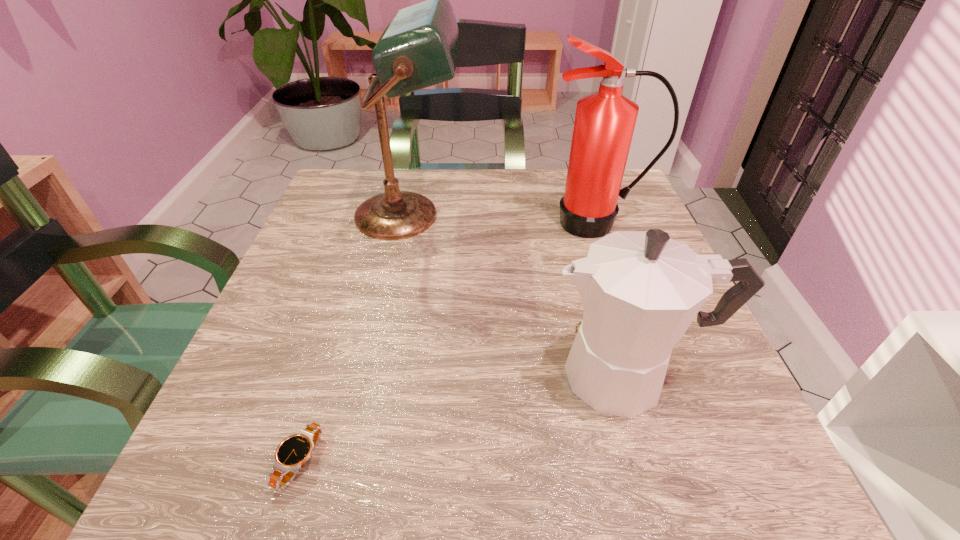
Locate an element on the screen. This screenshot has width=960, height=540. free space between the watch and the fire extinguisher is located at coordinates (448, 342).

Find the location of a particular element. This screenshot has width=960, height=540. vacant space in between the table lamp and the fire extinguisher is located at coordinates (503, 219).

Where is `vacant area between the table lamp and the shortest object`? vacant area between the table lamp and the shortest object is located at coordinates (354, 339).

The image size is (960, 540). In order to click on free spot between the table lamp and the shortest object in this screenshot , I will do `click(354, 339)`.

This screenshot has height=540, width=960. In order to click on vacant space that is in between the watch and the second nearest object in this screenshot , I will do [x=465, y=418].

Find the location of a particular element. The height and width of the screenshot is (540, 960). free space between the shortest object and the table lamp is located at coordinates 354,339.

The width and height of the screenshot is (960, 540). Find the location of `free space between the shortest object and the table lamp`. free space between the shortest object and the table lamp is located at coordinates (354, 339).

Where is `vacant space that's between the third farthest object and the shortest object`? The height and width of the screenshot is (540, 960). vacant space that's between the third farthest object and the shortest object is located at coordinates (465, 418).

Locate which object is the third closest to the shortest object. Please provide its 2D coordinates. Your answer should be formatted as a tuple, i.e. [(x, y)], where the tuple contains the x and y coordinates of a point satisfying the conditions above.

[(604, 124)]

Locate which object is the closest to the table lamp. Please provide its 2D coordinates. Your answer should be formatted as a tuple, i.e. [(x, y)], where the tuple contains the x and y coordinates of a point satisfying the conditions above.

[(604, 124)]